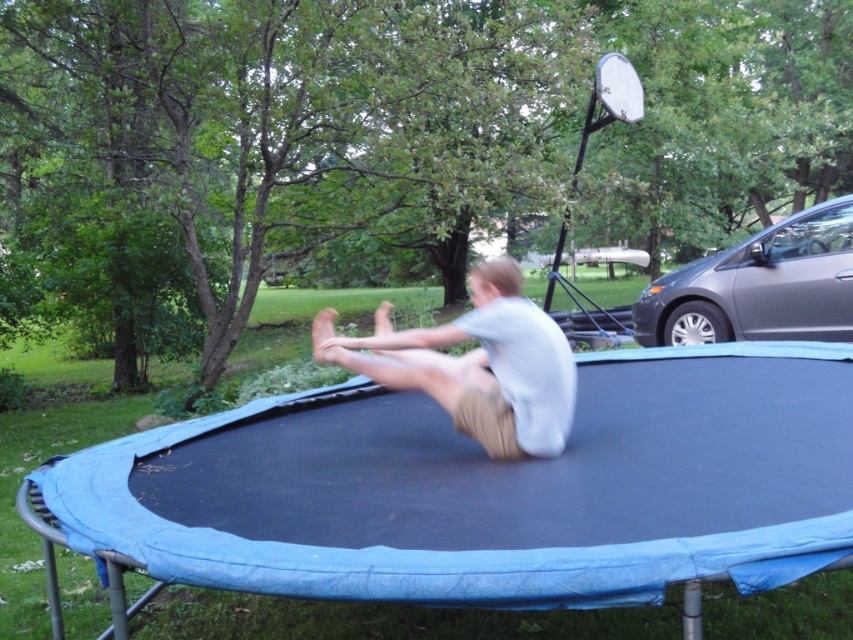
Question: Which object appears closest to the camera in this image?

Choices:
 (A) white glossy basketball hoop at upper right
 (B) light gray cotton shirt at center

Answer: (B)

Question: Does light gray cotton shirt at center appear on the right side of white glossy basketball hoop at upper right?

Choices:
 (A) yes
 (B) no

Answer: (B)

Question: Can you confirm if light gray cotton shirt at center is bigger than white glossy basketball hoop at upper right?

Choices:
 (A) yes
 (B) no

Answer: (A)

Question: Which point is closer to the camera?

Choices:
 (A) light gray cotton shirt at center
 (B) white glossy basketball hoop at upper right

Answer: (A)

Question: Can you confirm if light gray cotton shirt at center is smaller than white glossy basketball hoop at upper right?

Choices:
 (A) yes
 (B) no

Answer: (B)